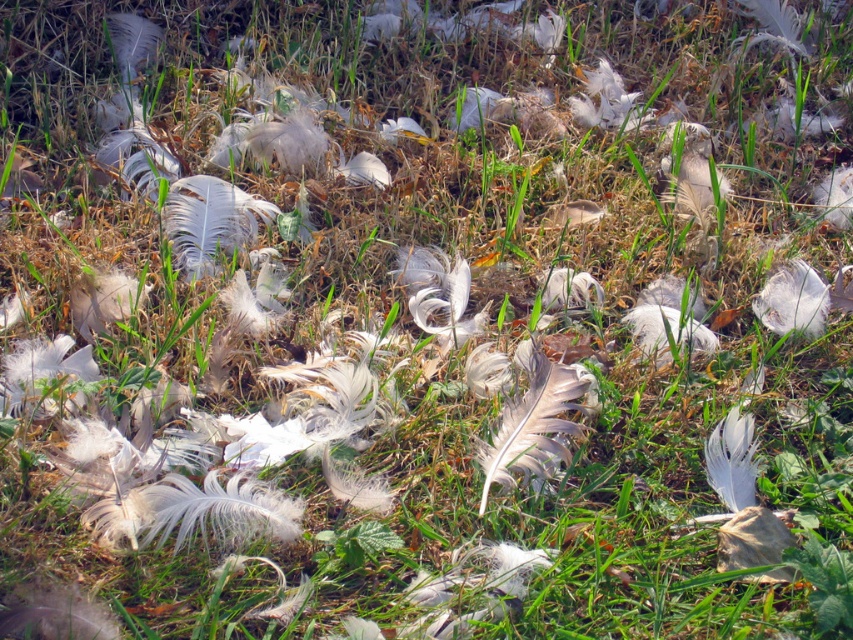
Question: Which point is closer to the camera taking this photo?

Choices:
 (A) (689, 177)
 (B) (514, 432)

Answer: (B)

Question: Does white soft feather at center appear on the right side of white feather at upper right?

Choices:
 (A) yes
 (B) no

Answer: (B)

Question: Is white soft feather at center wider than white feather at upper right?

Choices:
 (A) no
 (B) yes

Answer: (B)

Question: Does white soft feather at center appear on the left side of white feather at upper right?

Choices:
 (A) yes
 (B) no

Answer: (A)

Question: Which of the following is the farthest from the observer?

Choices:
 (A) (680, 198)
 (B) (538, 380)

Answer: (A)